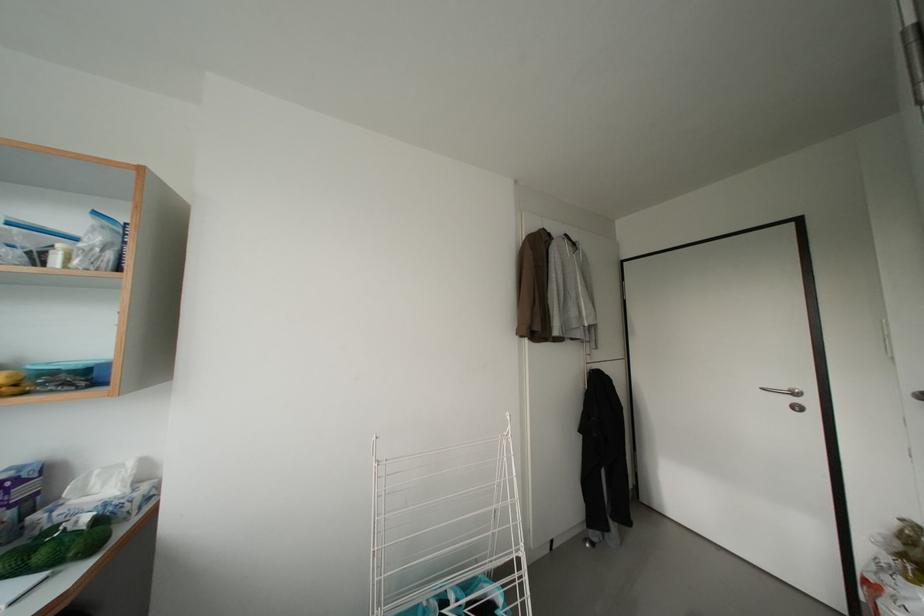
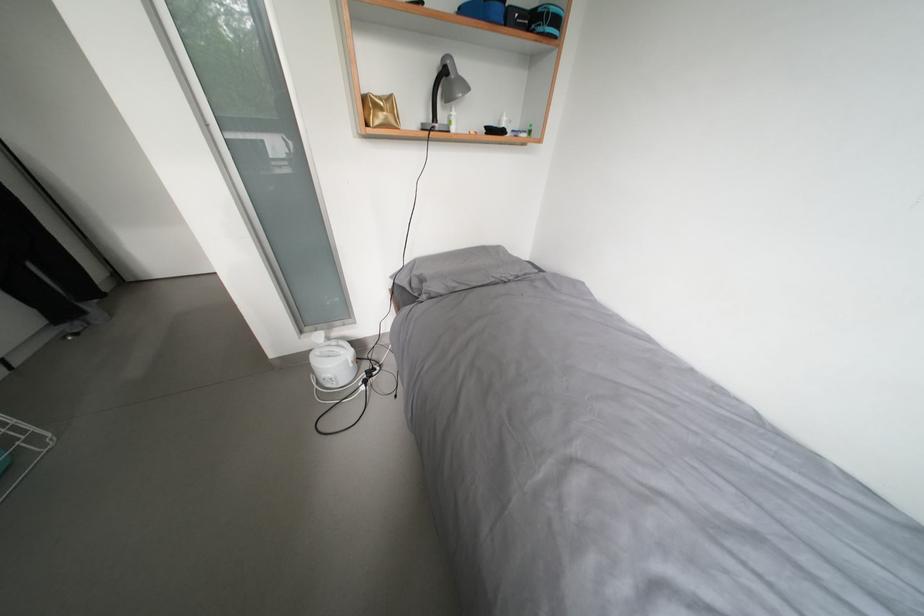
The images are taken continuously from a first-person perspective. In which direction is your viewpoint rotating?

The rotation direction of the camera is right-down.